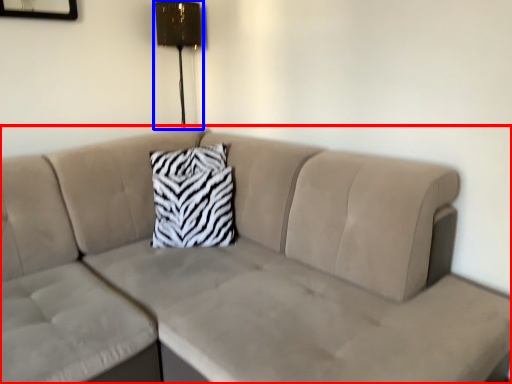
Question: Among these objects, which one is farthest to the camera, studio couch (highlighted by a red box) or lamp (highlighted by a blue box)?

Choices:
 (A) studio couch
 (B) lamp

Answer: (B)